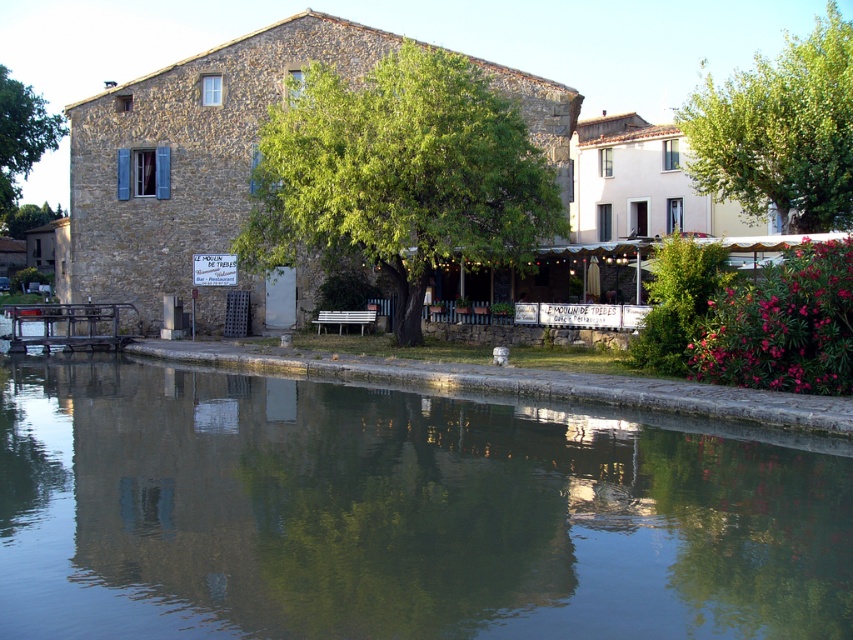
Question: Where is green reflective water at center located in relation to green leafy tree at left in the image?

Choices:
 (A) left
 (B) right

Answer: (B)

Question: Does green leafy tree at center have a larger size compared to green leafy tree at upper right?

Choices:
 (A) no
 (B) yes

Answer: (A)

Question: Based on their relative distances, which object is farther from the green leafy tree at upper right?

Choices:
 (A) green leafy tree at left
 (B) green leafy tree at center
 (C) green reflective water at center

Answer: (A)

Question: Which of the following is the closest to the observer?

Choices:
 (A) green leafy tree at left
 (B) green leafy tree at center
 (C) green reflective water at center

Answer: (C)

Question: Which of the following is the farthest from the observer?

Choices:
 (A) green leafy tree at left
 (B) green leafy tree at center
 (C) green reflective water at center
 (D) green leafy tree at upper right

Answer: (A)

Question: Does green leafy tree at upper right have a lesser width compared to green leafy tree at left?

Choices:
 (A) no
 (B) yes

Answer: (A)